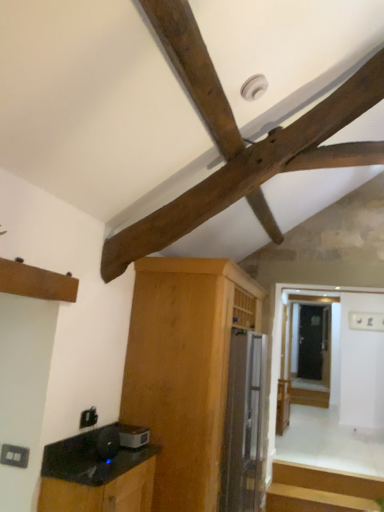
Question: From the image's perspective, is dark brown wood at upper center under black glossy cabinet at lower left, which is counted as the second cabinetry, starting from the back?

Choices:
 (A) yes
 (B) no

Answer: (B)

Question: From a real-world perspective, is dark brown wood at upper center located beneath black glossy cabinet at lower left, which is counted as the second cabinetry, starting from the back?

Choices:
 (A) yes
 (B) no

Answer: (B)

Question: Is dark brown wood at upper center smaller than black glossy cabinet at lower left, which is the 1th cabinetry from front to back?

Choices:
 (A) yes
 (B) no

Answer: (B)

Question: Is dark brown wood at upper center turned away from black glossy cabinet at lower left, which is counted as the second cabinetry, starting from the back?

Choices:
 (A) no
 (B) yes

Answer: (A)

Question: Is dark brown wood at upper center taller than black glossy cabinet at lower left, which is the 1th cabinetry from front to back?

Choices:
 (A) yes
 (B) no

Answer: (A)

Question: Considering the relative sizes of dark brown wood at upper center and black glossy cabinet at lower left, which is counted as the second cabinetry, starting from the back, in the image provided, is dark brown wood at upper center shorter than black glossy cabinet at lower left, which is counted as the second cabinetry, starting from the back,?

Choices:
 (A) no
 (B) yes

Answer: (A)

Question: Does satin silver toaster at lower center, the second appliance from the back, have a larger size compared to dark brown wood at upper center?

Choices:
 (A) no
 (B) yes

Answer: (A)

Question: From the image's perspective, is satin silver toaster at lower center, the second appliance from the back, on dark brown wood at upper center?

Choices:
 (A) yes
 (B) no

Answer: (B)

Question: Is satin silver toaster at lower center, the second appliance from the back, far from dark brown wood at upper center?

Choices:
 (A) yes
 (B) no

Answer: (A)

Question: Can you confirm if satin silver toaster at lower center, which is counted as the 2th appliance, starting from the right, is wider than dark brown wood at upper center?

Choices:
 (A) no
 (B) yes

Answer: (A)

Question: Can you confirm if satin silver toaster at lower center, the second appliance from the back, is shorter than dark brown wood at upper center?

Choices:
 (A) no
 (B) yes

Answer: (B)

Question: Can you confirm if satin silver toaster at lower center, which is counted as the 2th appliance, starting from the right, is positioned to the left of dark brown wood at upper center?

Choices:
 (A) yes
 (B) no

Answer: (A)

Question: Is black glossy cabinet at lower left, which is counted as the second cabinetry, starting from the back, closer to the viewer compared to satin silver refrigerator at center, which is the first appliance from back to front?

Choices:
 (A) yes
 (B) no

Answer: (A)